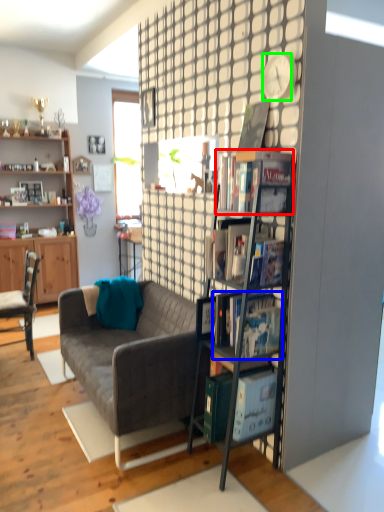
Question: Which is nearer to the book (highlighted by a red box)? book (highlighted by a blue box) or clock (highlighted by a green box).

Choices:
 (A) book
 (B) clock

Answer: (B)